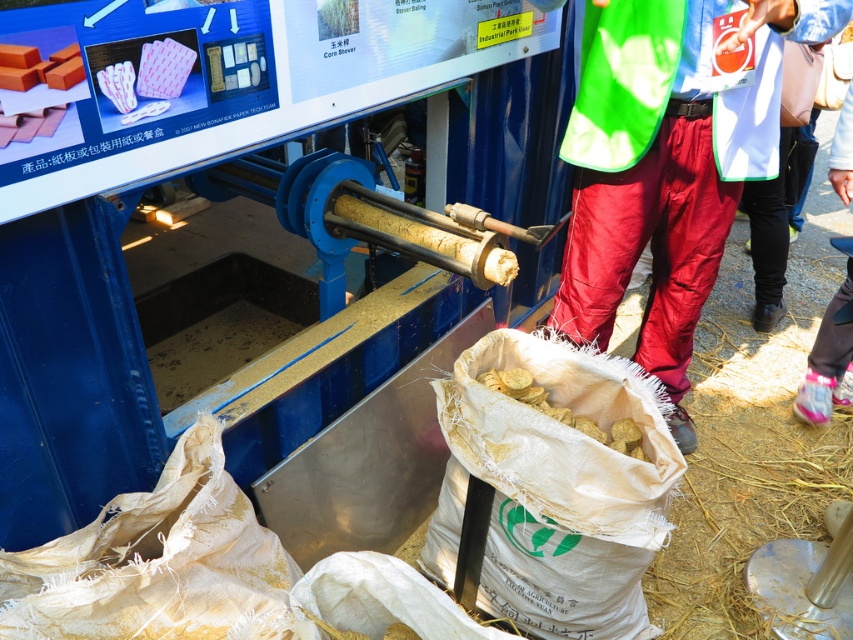
Can you confirm if red nylon pants at right is wider than yellow matte chips at lower center?

Correct, the width of red nylon pants at right exceeds that of yellow matte chips at lower center.

Is red nylon pants at right positioned behind yellow matte chips at lower center?

No, it is not.

Where is `red nylon pants at right`? Image resolution: width=853 pixels, height=640 pixels. red nylon pants at right is located at coordinates (653, 234).